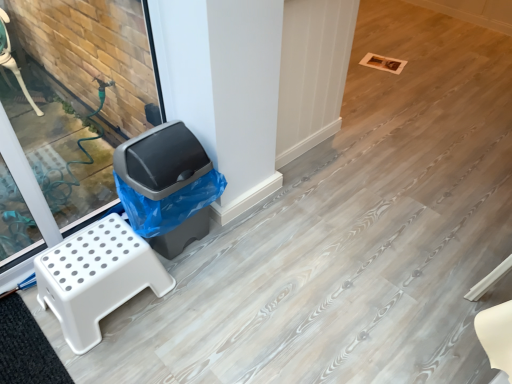
Question: From the image's perspective, is gray plastic trash can at left above or below white plastic step stool at left?

Choices:
 (A) below
 (B) above

Answer: (B)

Question: Considering their positions, is gray plastic trash can at left located in front of or behind white plastic step stool at left?

Choices:
 (A) front
 (B) behind

Answer: (B)

Question: Which object is positioned closest to the black rubber mat at lower left?

Choices:
 (A) white plastic step stool at left
 (B) gray plastic trash can at left

Answer: (A)

Question: Estimate the real-world distances between objects in this image. Which object is closer to the gray plastic trash can at left?

Choices:
 (A) black rubber mat at lower left
 (B) white plastic step stool at left

Answer: (B)